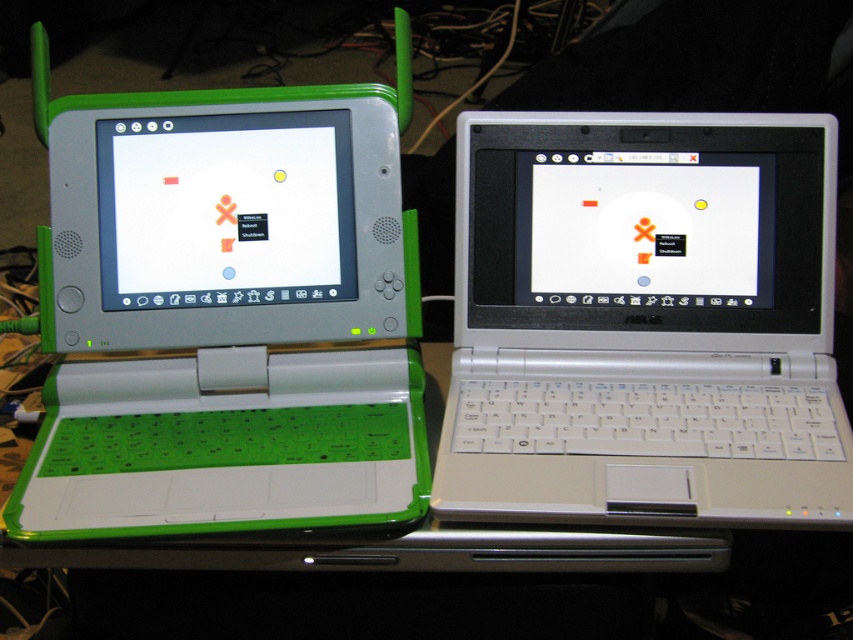
Measure the distance from white plastic laptop at center to green matte screen at left.

white plastic laptop at center and green matte screen at left are 12.16 inches apart from each other.

In order to click on white plastic laptop at center in this screenshot , I will do `click(643, 321)`.

I want to click on white plastic laptop at center, so click(643, 321).

Find the location of `white plastic laptop at center`. white plastic laptop at center is located at coordinates click(643, 321).

Is green matte laptop at left further to camera compared to white plastic laptop at center?

Yes, it is.

Is point (268, 413) positioned behind point (694, 316)?

That is False.

The width and height of the screenshot is (853, 640). What do you see at coordinates (225, 310) in the screenshot?
I see `green matte laptop at left` at bounding box center [225, 310].

Find the location of a particular element. green matte laptop at left is located at coordinates [225, 310].

Can you confirm if green matte laptop at left is positioned to the left of green matte screen at left?

Indeed, green matte laptop at left is positioned on the left side of green matte screen at left.

Image resolution: width=853 pixels, height=640 pixels. What do you see at coordinates (225, 310) in the screenshot?
I see `green matte laptop at left` at bounding box center [225, 310].

Identify the location of green matte laptop at left. The image size is (853, 640). (x=225, y=310).